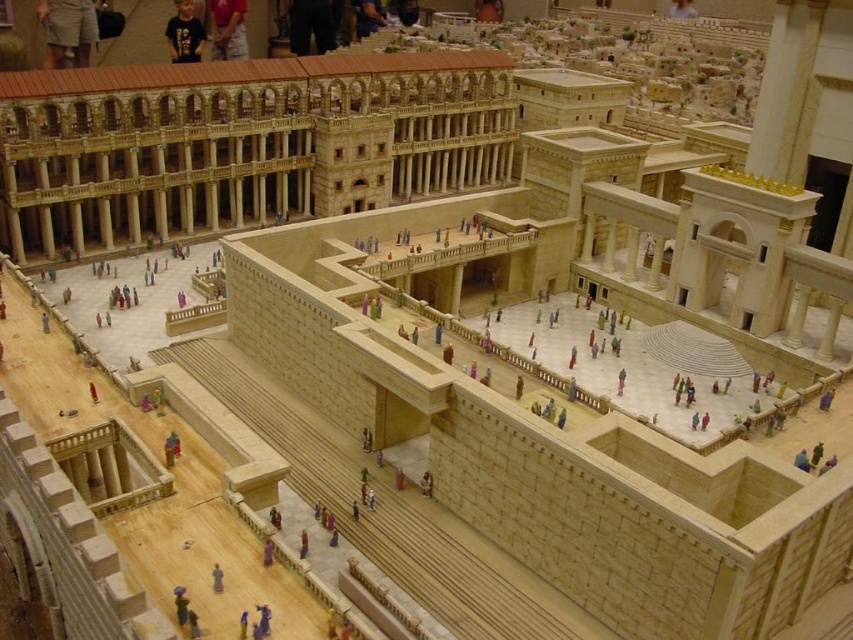
Which is below, dark blue shirt at upper center or black t-shirt at upper center?

black t-shirt at upper center is below.

Is dark blue shirt at upper center taller than black t-shirt at upper center?

In fact, dark blue shirt at upper center may be shorter than black t-shirt at upper center.

You are a GUI agent. You are given a task and a screenshot of the screen. Output one action in this format:
    pyautogui.click(x=<x>, y=<y>)
    Task: Click on the dark blue shirt at upper center
    Image resolution: width=853 pixels, height=640 pixels.
    Given the screenshot: What is the action you would take?
    pyautogui.click(x=227, y=28)

Is point (62, 35) positioned after point (273, 550)?

Yes, it is.

Is khaki shorts at upper left taller than purple fabric person at lower center?

Correct, khaki shorts at upper left is much taller as purple fabric person at lower center.

Does point (91, 0) come farther from viewer compared to point (273, 544)?

Yes, point (91, 0) is behind point (273, 544).

Image resolution: width=853 pixels, height=640 pixels. What are the coordinates of `khaki shorts at upper left` in the screenshot? It's located at (68, 29).

Can you confirm if black t-shirt at upper center is thinner than purple fabric person at lower center?

No.

Between black t-shirt at upper center and purple fabric person at lower center, which one has more height?

black t-shirt at upper center

The width and height of the screenshot is (853, 640). I want to click on black t-shirt at upper center, so 184,33.